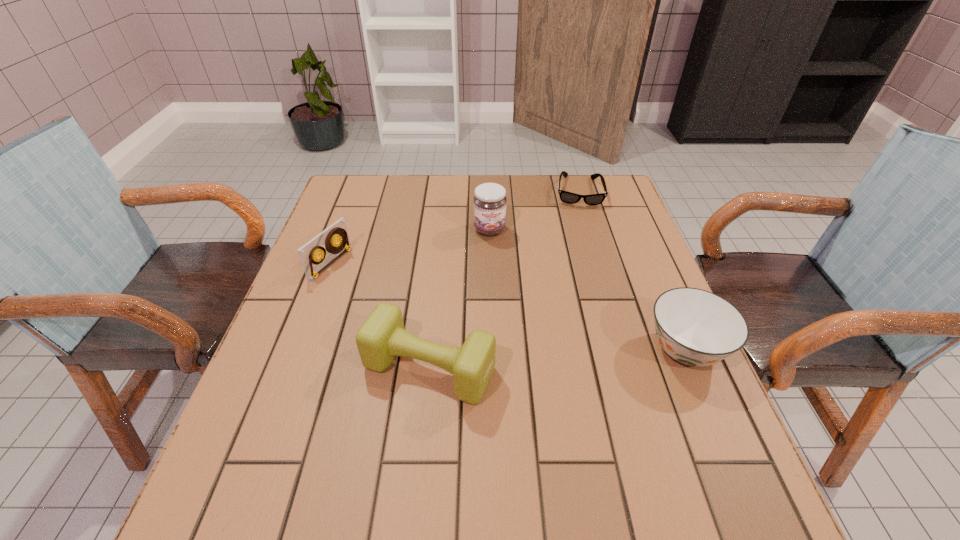
The height and width of the screenshot is (540, 960). What are the coordinates of `soup bowl that is at the right edge` in the screenshot? It's located at (695, 327).

Find the location of a particular element. sunglasses that is positioned at the right edge is located at coordinates (567, 197).

Find the location of `object located at the far right corner`. object located at the far right corner is located at coordinates (567, 197).

The image size is (960, 540). In order to click on free space at the far edge of the desktop in this screenshot , I will do `click(465, 180)`.

You are a GUI agent. You are given a task and a screenshot of the screen. Output one action in this format:
    pyautogui.click(x=<x>, y=<y>)
    Task: Click on the free spot at the near edge of the desktop
    This screenshot has width=960, height=540.
    Given the screenshot: What is the action you would take?
    pyautogui.click(x=394, y=418)

Identify the location of vacant area at the left edge of the desktop. This screenshot has width=960, height=540. (323, 275).

In the image, there is a desktop. Where is `vacant space at the right edge`? This screenshot has height=540, width=960. vacant space at the right edge is located at coordinates (598, 288).

The width and height of the screenshot is (960, 540). In the image, there is a desktop. What are the coordinates of `vacant space at the far left corner` in the screenshot? It's located at (371, 207).

Find the location of a particular element. The height and width of the screenshot is (540, 960). vacant space at the far right corner of the desktop is located at coordinates (598, 211).

Locate an element on the screen. vacant space at the near right corner is located at coordinates (636, 430).